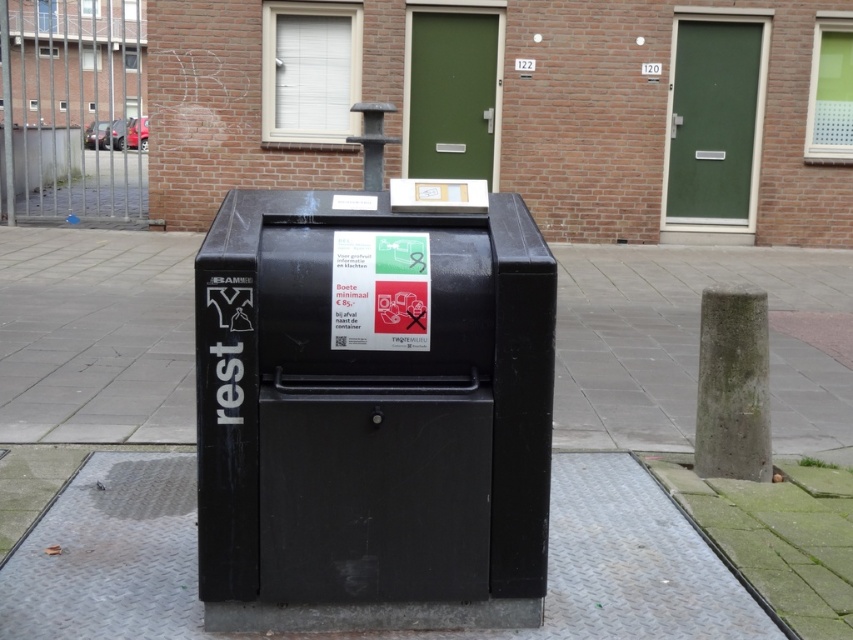
You are designing a layout for a new public area and need to ensure that the black matte mailbox at center and the metallic gray pavement at lower center are placed in a way that the mailbox doesn t overwhelm the pavement visually. Based on their sizes, which object should be positioned where to maintain balance?

Since the black matte mailbox at center occupies less space than the metallic gray pavement at lower center, the mailbox can be placed closer to the pavement to maintain visual balance without overwhelming it.